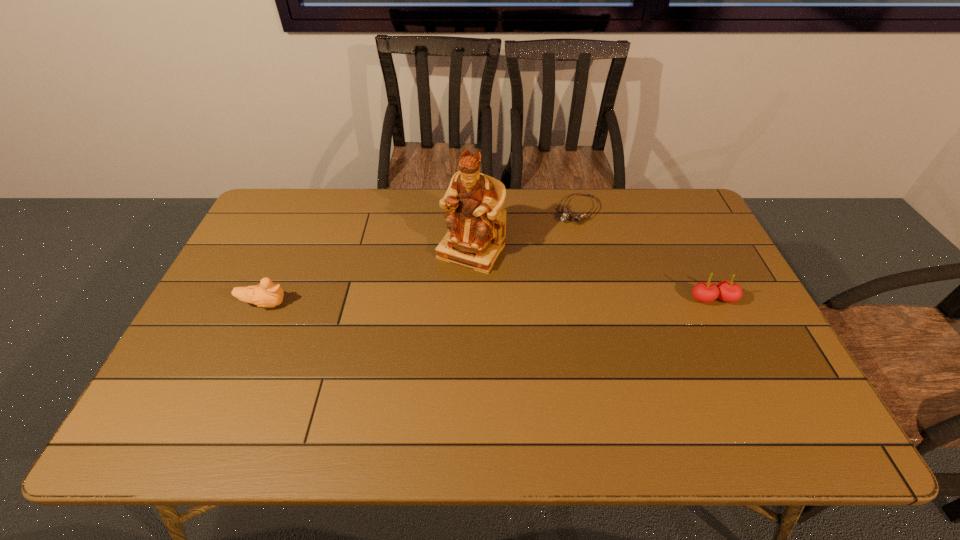
The height and width of the screenshot is (540, 960). I want to click on vacant space on the desktop that is between the duckling and the cherry and is positioned on the front lenses and sides of the shortest object, so click(x=516, y=301).

Image resolution: width=960 pixels, height=540 pixels. I want to click on free spot on the desktop that is between the leftmost object and the rightmost object and is positioned on the front-facing side of the figurine, so click(x=437, y=302).